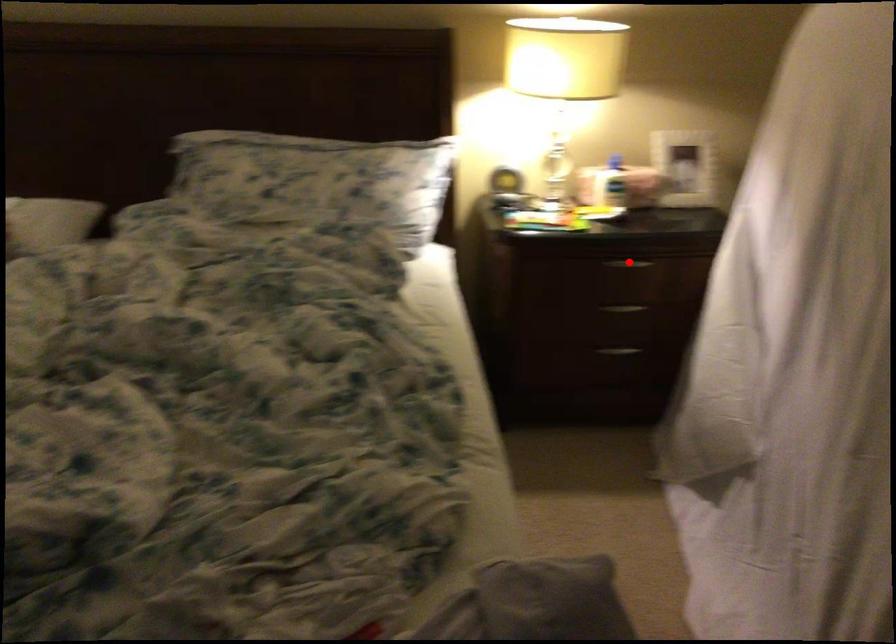
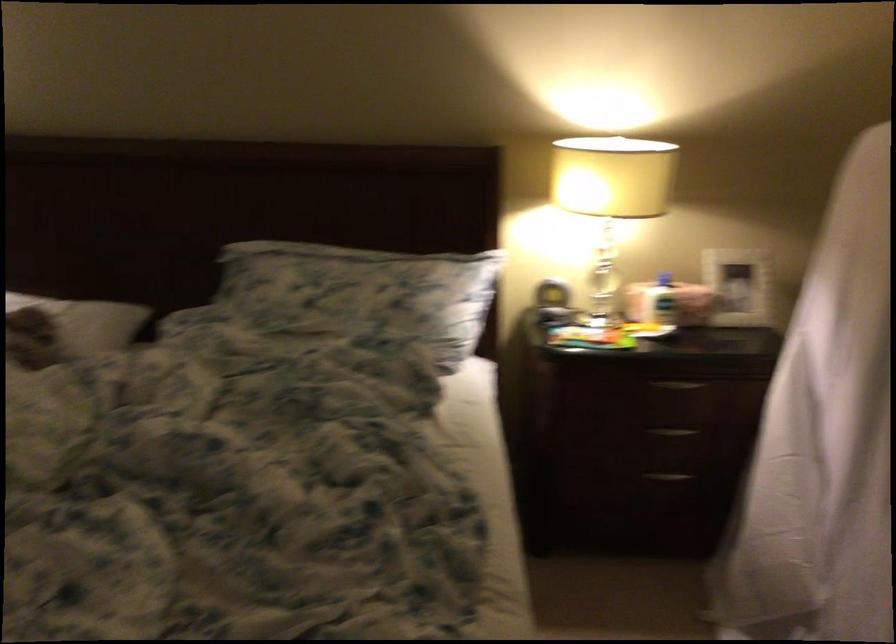
Where in the second image is the point corresponding to the highlighted location from the first image?

(679, 384)